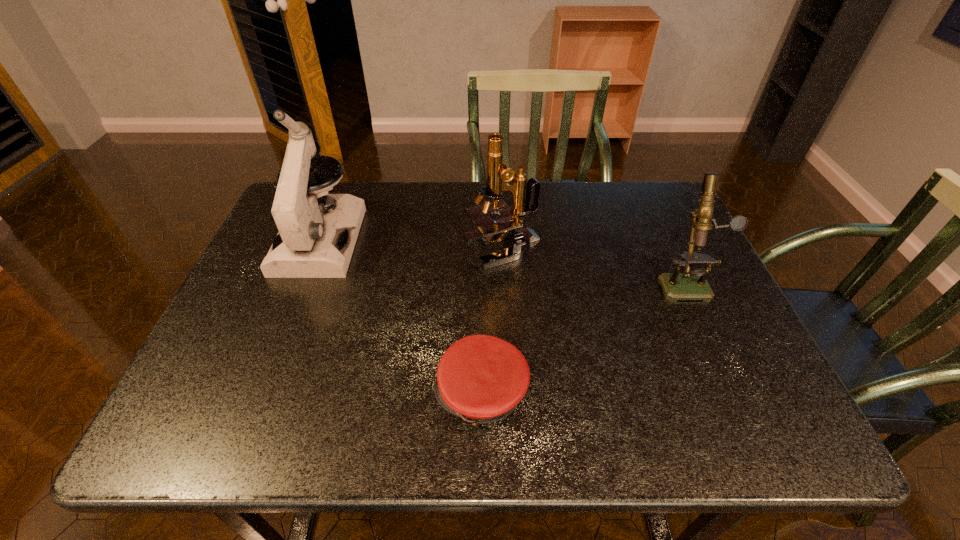
The width and height of the screenshot is (960, 540). What are the coordinates of `free space located 0.120m at the eyepiece of the rightmost microscope` in the screenshot? It's located at (714, 342).

I want to click on free region located on the front of the nearest object with an emblem, so click(238, 394).

I want to click on vacant position located on the front of the nearest object with an emblem, so click(x=398, y=394).

The image size is (960, 540). Find the location of `free region located 0.170m on the front of the nearest object with an emblem`. free region located 0.170m on the front of the nearest object with an emblem is located at coordinates (348, 394).

The width and height of the screenshot is (960, 540). Find the location of `object located at the near edge`. object located at the near edge is located at coordinates (480, 378).

Find the location of `object that is at the left edge`. object that is at the left edge is located at coordinates tap(310, 244).

The image size is (960, 540). Identify the location of object that is at the right edge. (692, 285).

The image size is (960, 540). In order to click on object that is at the far left corner in this screenshot , I will do `click(310, 244)`.

In the image, there is a desktop. Where is `free space at the far edge`? The image size is (960, 540). free space at the far edge is located at coordinates (541, 206).

Where is `free space at the near edge`? The image size is (960, 540). free space at the near edge is located at coordinates (641, 427).